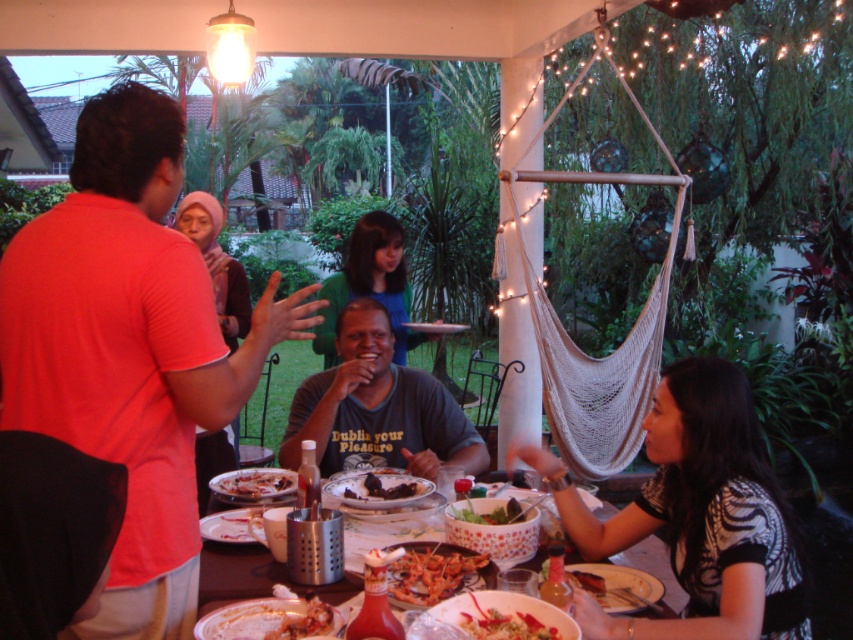
Can you confirm if green fabric shirt at center is positioned to the right of shiny plastic fork at lower center?

In fact, green fabric shirt at center is to the left of shiny plastic fork at lower center.

Does point (397, 225) come closer to viewer compared to point (540, 624)?

That is False.

Is point (380, 211) farther from viewer compared to point (502, 632)?

Yes, point (380, 211) is farther from viewer.

Find the location of a particular element. The image size is (853, 640). green fabric shirt at center is located at coordinates (370, 284).

Which is in front, point (305, 426) or point (479, 554)?

Positioned in front is point (479, 554).

Which is below, dark gray t-shirt at center or shiny red lobster at center?

shiny red lobster at center is lower down.

What do you see at coordinates (376, 408) in the screenshot? I see `dark gray t-shirt at center` at bounding box center [376, 408].

You are a GUI agent. You are given a task and a screenshot of the screen. Output one action in this format:
    pyautogui.click(x=<x>, y=<y>)
    Task: Click on the dark gray t-shirt at center
    
    Given the screenshot: What is the action you would take?
    pyautogui.click(x=376, y=408)

Does point (223, 284) come in front of point (517, 509)?

No, it is not.

Is pink fabric headscarf at upper left taller than smooth plastic bowl at center?

Indeed, pink fabric headscarf at upper left has a greater height compared to smooth plastic bowl at center.

Where is `pink fabric headscarf at upper left`? pink fabric headscarf at upper left is located at coordinates (216, 262).

The height and width of the screenshot is (640, 853). What are the coordinates of `pink fabric headscarf at upper left` in the screenshot? It's located at coord(216,262).